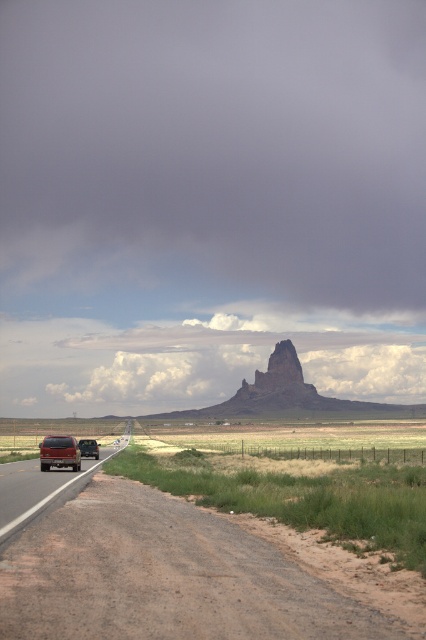
Question: Is smooth asphalt highway at center positioned at the back of matte red car at left?

Choices:
 (A) no
 (B) yes

Answer: (A)

Question: Does dark gray cloud at upper center appear over rugged rock formation at center?

Choices:
 (A) no
 (B) yes

Answer: (B)

Question: Which point is farther to the camera?

Choices:
 (A) (2, 600)
 (B) (123, 433)

Answer: (B)

Question: Which of these objects is positioned closest to the rugged rock formation at center?

Choices:
 (A) metallic red suv at left
 (B) matte red car at left
 (C) dark gray cloud at upper center
 (D) smooth asphalt highway at center

Answer: (B)

Question: Considering the real-world distances, which object is closest to the rugged rock formation at center?

Choices:
 (A) matte red car at left
 (B) metallic red suv at left

Answer: (A)

Question: Does smooth asphalt highway at center appear on the right side of rugged rock formation at center?

Choices:
 (A) no
 (B) yes

Answer: (A)